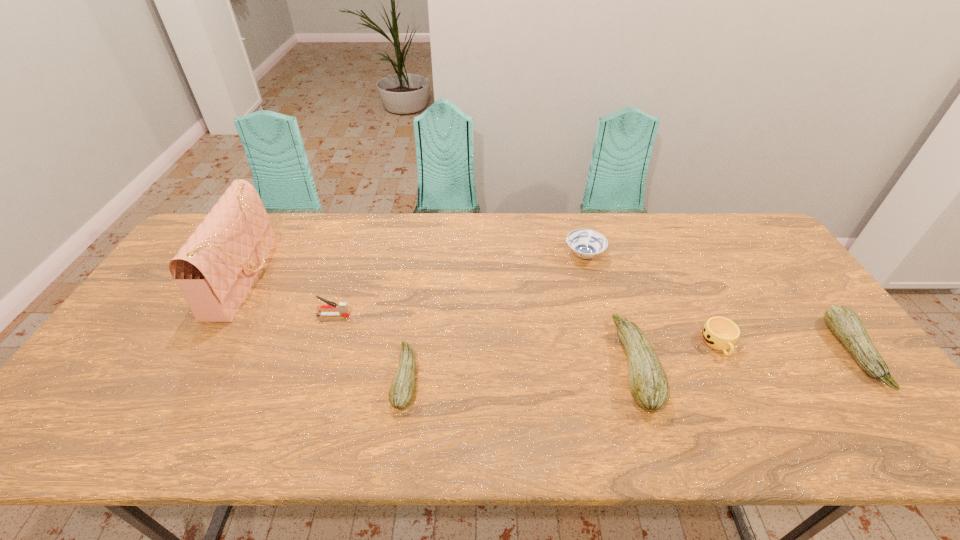
Identify which zucchini is the closest to the tallest object. Please provide its 2D coordinates. Your answer should be formatted as a tuple, i.e. [(x, y)], where the tuple contains the x and y coordinates of a point satisfying the conditions above.

[(401, 392)]

This screenshot has height=540, width=960. What are the coordinates of `zucchini identified as the third closest to the stapler` in the screenshot? It's located at (844, 323).

The height and width of the screenshot is (540, 960). In order to click on vacant space that satisfies the following two spatial constraints: 1. on the front side of the soup bowl; 2. on the handle side of the stapler in this screenshot , I will do `click(600, 315)`.

Where is `free space that satisfies the following two spatial constraints: 1. on the handle side of the second object from right to left; 2. on the right side of the stapler`? free space that satisfies the following two spatial constraints: 1. on the handle side of the second object from right to left; 2. on the right side of the stapler is located at coordinates (324, 344).